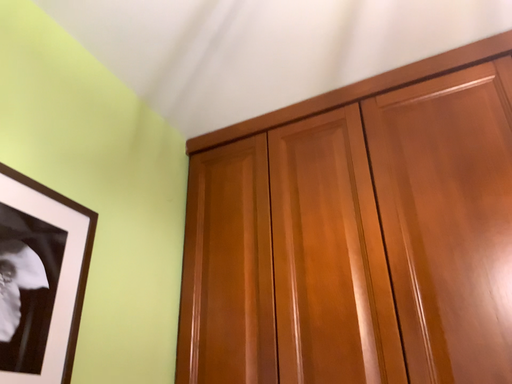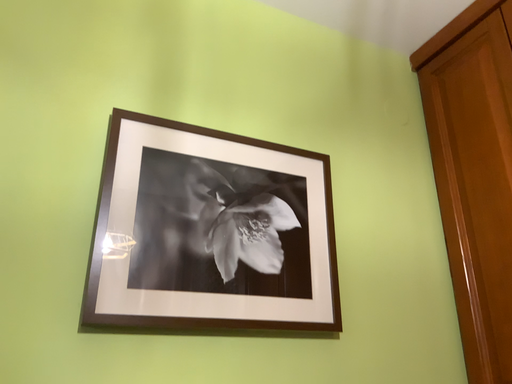
Question: How did the camera likely rotate when shooting the video?

Choices:
 (A) rotated right
 (B) rotated left

Answer: (B)